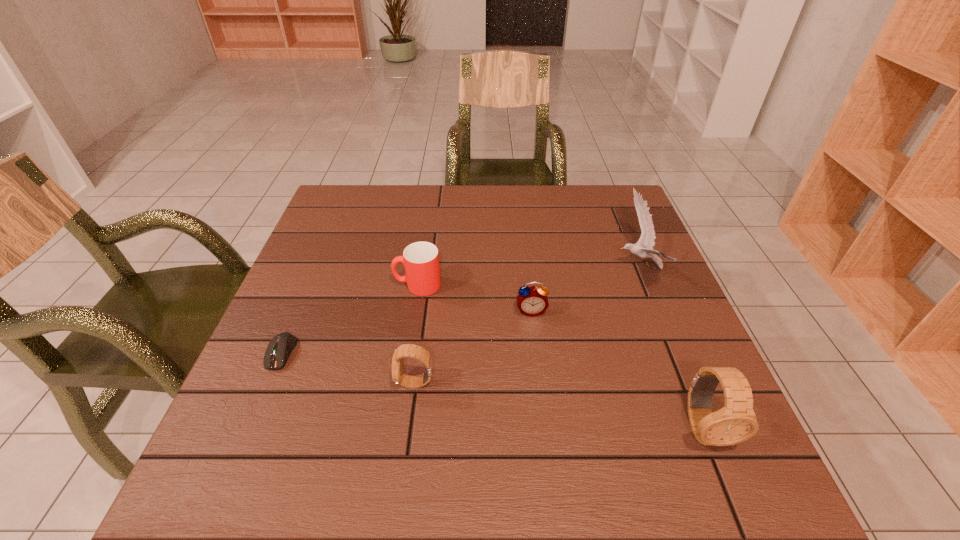
Where is `vacant space located 0.080m on the face of the left watch`? This screenshot has width=960, height=540. vacant space located 0.080m on the face of the left watch is located at coordinates (356, 383).

This screenshot has width=960, height=540. What are the coordinates of `vacant space located on the face of the left watch` in the screenshot? It's located at (304, 383).

Identify the location of vacant space located 0.190m on the side of the cup with the handle. (315, 285).

At what (x,y) coordinates should I click in order to perform the action: click on free region located 0.080m on the side of the cup with the handle. Please return your answer as a coordinate pair (x, y). Looking at the image, I should click on (361, 285).

Where is `vacant space situated 0.220m on the side of the cup with the handle`? vacant space situated 0.220m on the side of the cup with the handle is located at coordinates (302, 285).

You are a GUI agent. You are given a task and a screenshot of the screen. Output one action in this format:
    pyautogui.click(x=<x>, y=<y>)
    Task: Click on the vacant region located on the front-facing side of the alarm clock
    
    Given the screenshot: What is the action you would take?
    pyautogui.click(x=537, y=353)

Where is `vacant point located 0.150m at the tip of the beak of the gull`? vacant point located 0.150m at the tip of the beak of the gull is located at coordinates (556, 267).

Locate an element on the screen. This screenshot has width=960, height=540. free spot located at the tip of the beak of the gull is located at coordinates (496, 267).

Find the location of a particular element. This screenshot has height=540, width=960. vacant position located 0.400m at the tip of the beak of the gull is located at coordinates (456, 267).

At what (x,y) coordinates should I click in order to perform the action: click on vacant area situated on the button of the computer equipment. Please return your answer as a coordinate pair (x, y). Looking at the image, I should click on (260, 402).